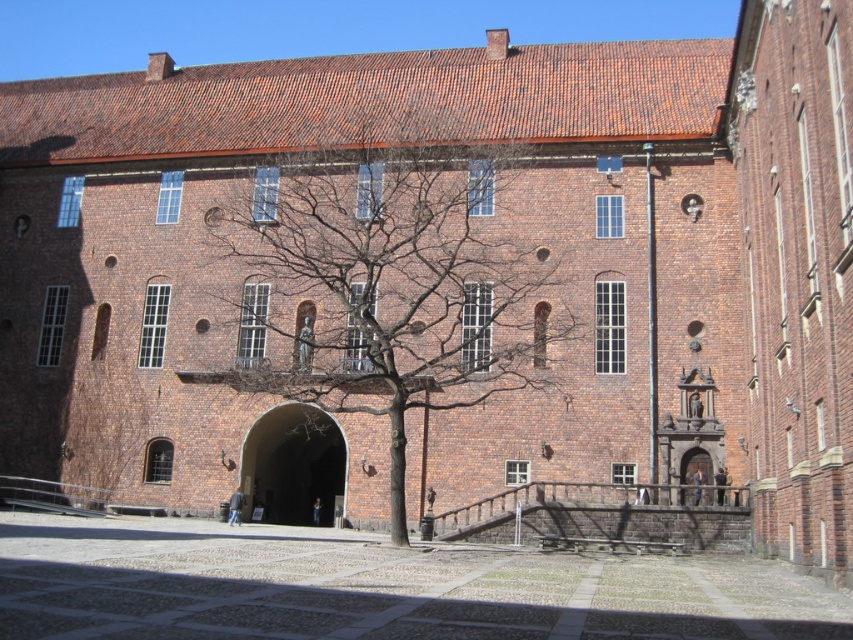
From the picture: Does brown stone archway at center have a greater height compared to wooden door at center?

Yes.

Can you confirm if brown stone archway at center is wider than wooden door at center?

Correct, the width of brown stone archway at center exceeds that of wooden door at center.

Between point (271, 436) and point (701, 490), which one is positioned in front?

Positioned in front is point (701, 490).

This screenshot has height=640, width=853. In order to click on brown stone archway at center in this screenshot , I will do `click(292, 465)`.

Is point (407, 336) positioned before point (701, 452)?

No.

Who is higher up, bare branches at center or wooden door at center?

bare branches at center

Which is in front, point (314, 390) or point (680, 483)?

Point (680, 483)

Find the location of `bare branches at center`. bare branches at center is located at coordinates 387,276.

Which of these two, bare branches at center or brown stone archway at center, stands shorter?

brown stone archway at center is shorter.

Does bare branches at center have a larger size compared to brown stone archway at center?

Correct, bare branches at center is larger in size than brown stone archway at center.

Which is in front, point (361, 356) or point (308, 438)?

Point (361, 356) is in front.

The image size is (853, 640). Identify the location of bare branches at center. (387, 276).